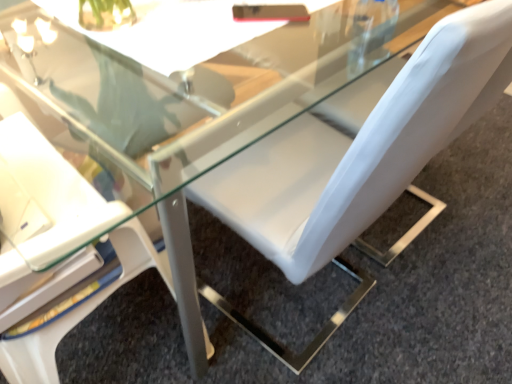
Identify the location of vacant space to the right of white leather chair at center, the 2th chair when ordered from left to right. The height and width of the screenshot is (384, 512). (442, 279).